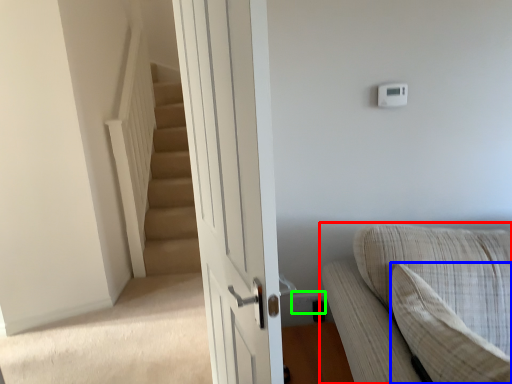
Question: Which object is positioned closest to studio couch (highlighted by a red box)? Select from pillow (highlighted by a blue box) and electric outlet (highlighted by a green box).

Choices:
 (A) pillow
 (B) electric outlet

Answer: (A)